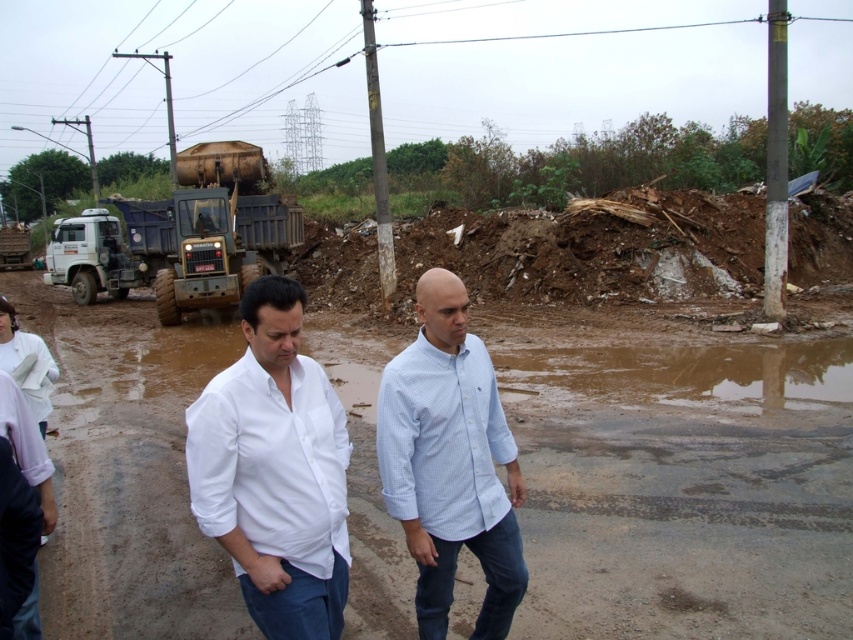
You are a photographer trying to capture both the white cotton shirt at center and the light blue checkered shirt at center in a single frame. Given that your camera has a depth of field that can only focus on one person at a time, which person should you focus on to ensure the other remains relatively in focus?

The white cotton shirt at center is thinner than the light blue checkered shirt at center, so focusing on the thicker light blue checkered shirt at center would keep the thinner white cotton shirt at center within the depth of field range, ensuring both are relatively in focus.

Looking at this image, you are a safety inspector at the construction site. You notice two workers, the white cotton shirt at center and the light blue checkered shirt at center, walking near the muddy puddles. According to safety protocols, workers must stay at least 3 meters away from any puddles deeper than 30 cm. Can you determine if they are compliant with this rule?

The white cotton shirt at center is in front of the light blue checkered shirt at center, but there is no information provided about the depth of the puddles or their distance from the workers. Therefore, compliance with the safety rule cannot be determined based on the given information.